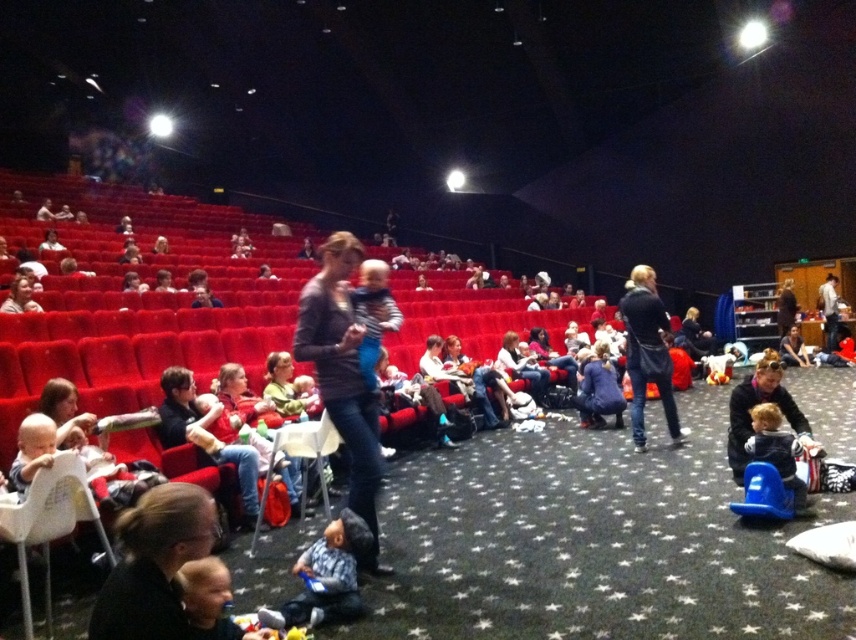
You are sitting in the auditorium and notice two items in the scene. One is a light brown plush toy at lower right and the other is a matte black jacket at upper left. Based on their positions, which item is located more to the east side of the auditorium?

The light brown plush toy at lower right is located to the right of the matte black jacket at upper left, so it is positioned more to the east side of the auditorium.